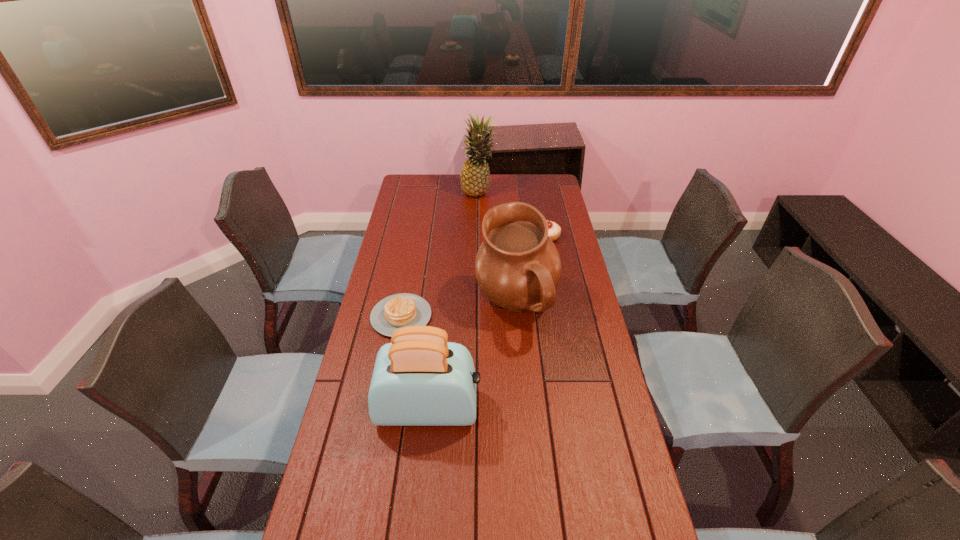
In the image, there is a desktop. Identify the location of free space at the right edge. tap(554, 207).

In the image, there is a desktop. Find the location of `vacant area at the far left corner`. vacant area at the far left corner is located at coordinates (428, 181).

Locate an element on the screen. vacant space at the far right corner of the desktop is located at coordinates (530, 184).

The height and width of the screenshot is (540, 960). Find the location of `free spot between the cream pitcher and the toaster`. free spot between the cream pitcher and the toaster is located at coordinates (472, 357).

This screenshot has width=960, height=540. I want to click on free space that is in between the fourth nearest object and the nearest object, so click(x=488, y=322).

Locate an element on the screen. The width and height of the screenshot is (960, 540). object that can be found as the closest to the cream pitcher is located at coordinates (396, 311).

Choose which object is the second nearest neighbor to the second shortest object. Please provide its 2D coordinates. Your answer should be formatted as a tuple, i.e. [(x, y)], where the tuple contains the x and y coordinates of a point satisfying the conditions above.

[(475, 175)]